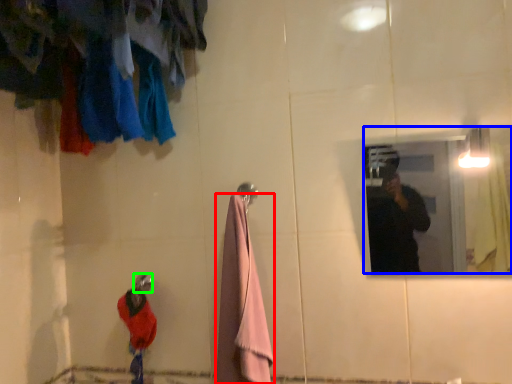
Question: Considering the real-world distances, which object is closest to towel/napkin (highlighted by a red box)? mirror (highlighted by a blue box) or shower (highlighted by a green box).

Choices:
 (A) mirror
 (B) shower

Answer: (B)